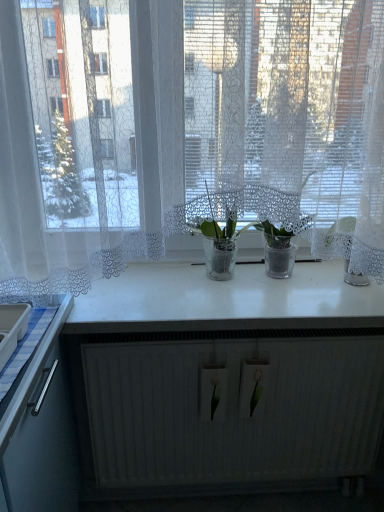
Identify the location of free space to the left of translucent glass vase at center. This screenshot has width=384, height=512. (156, 282).